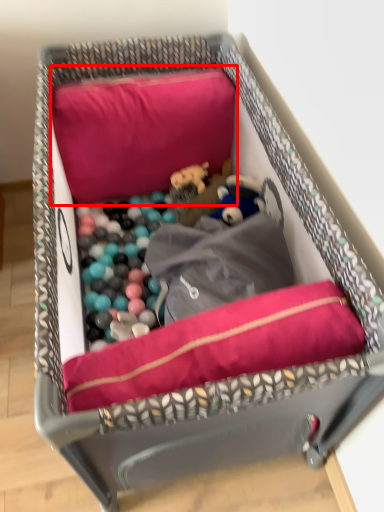
Question: From the image, what is the correct spatial relationship of pillow (annotated by the red box) in relation to dog bed?

Choices:
 (A) right
 (B) left

Answer: (B)